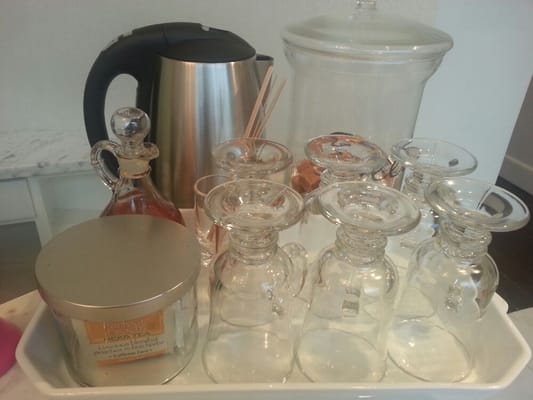
This screenshot has width=533, height=400. I want to click on small glass pitcher, so click(x=135, y=189).